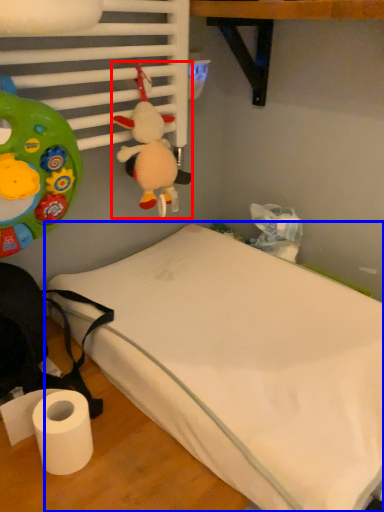
Question: Which point is closer to the camera, toy (highlighted by a red box) or bed (highlighted by a blue box)?

Choices:
 (A) toy
 (B) bed

Answer: (B)